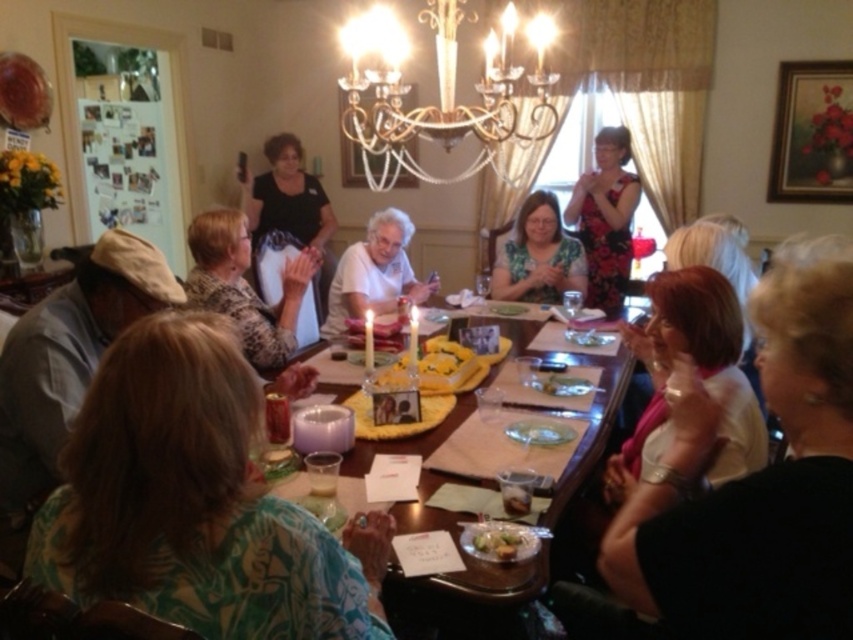
You are standing at the center of the dining table and want to hand a gift to the person wearing the green floral shirt at lower left. In which direction should you move to reach them?

The green floral shirt at lower left is located at coordinates point [195,500], so you should move towards the lower left direction to reach them.

You are a photographer taking a group photo of the people at the table. You want to ensure both the green floral shirt at lower left and the green leafy salad at center are clearly visible in the frame. Which object should you focus on to ensure it doesn

The green floral shirt at lower left is bigger than the green leafy salad at center, so focusing on the green floral shirt at lower left would ensure it is clearly visible, and the smaller salad will also be in focus if within the depth of field.